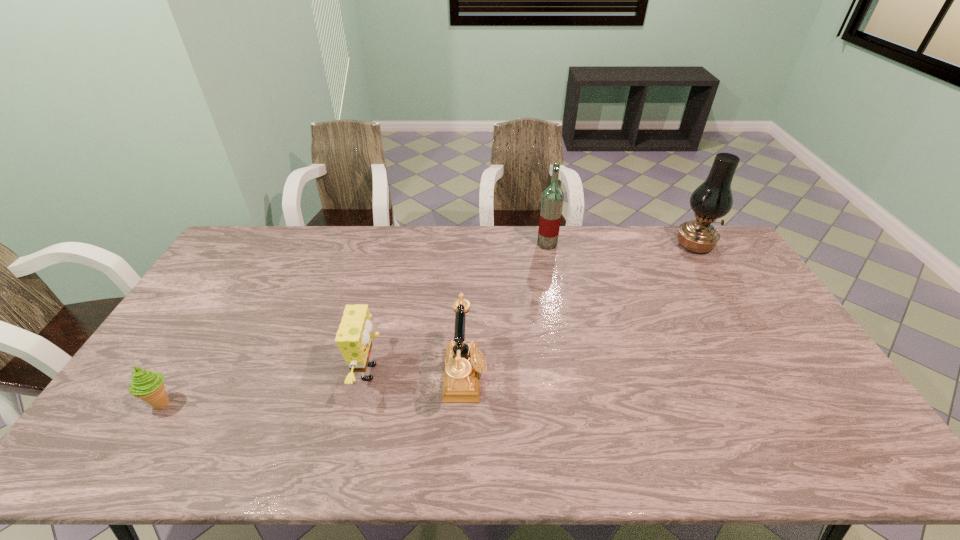
This screenshot has width=960, height=540. I want to click on vacant position located 0.070m on the right of the leftmost object, so click(x=204, y=403).

The image size is (960, 540). Find the location of `oil lamp present at the far edge`. oil lamp present at the far edge is located at coordinates (713, 199).

Where is `liquor situated at the far edge`? The height and width of the screenshot is (540, 960). liquor situated at the far edge is located at coordinates (552, 199).

Where is `object present at the left edge`? object present at the left edge is located at coordinates (147, 385).

Find the location of `object that is positioned at the right edge`. object that is positioned at the right edge is located at coordinates (713, 199).

Locate an element on the screen. object located in the far right corner section of the desktop is located at coordinates (713, 199).

In the image, there is a desktop. At what (x,y) coordinates should I click in order to perform the action: click on free space at the far edge. Please return your answer as a coordinate pair (x, y). This screenshot has height=540, width=960. Looking at the image, I should click on (411, 225).

This screenshot has height=540, width=960. Identify the location of vacant space at the near edge of the desktop. (558, 456).

In the image, there is a desktop. Identify the location of vacant area at the left edge. (177, 391).

Identify the location of free location at the right edge of the desktop. This screenshot has height=540, width=960. (749, 288).